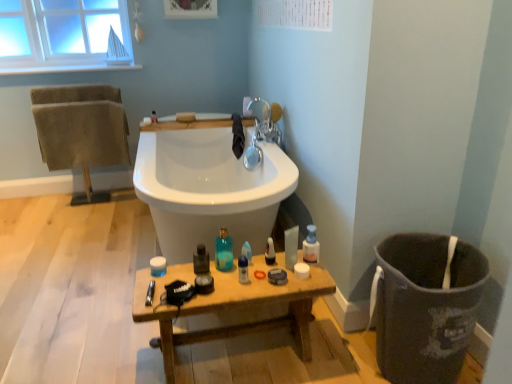
Locate an element on the screen. free space in front of translucent glass mouthwash at center, placed as the second mouthwash when sorted from right to left is located at coordinates (211, 288).